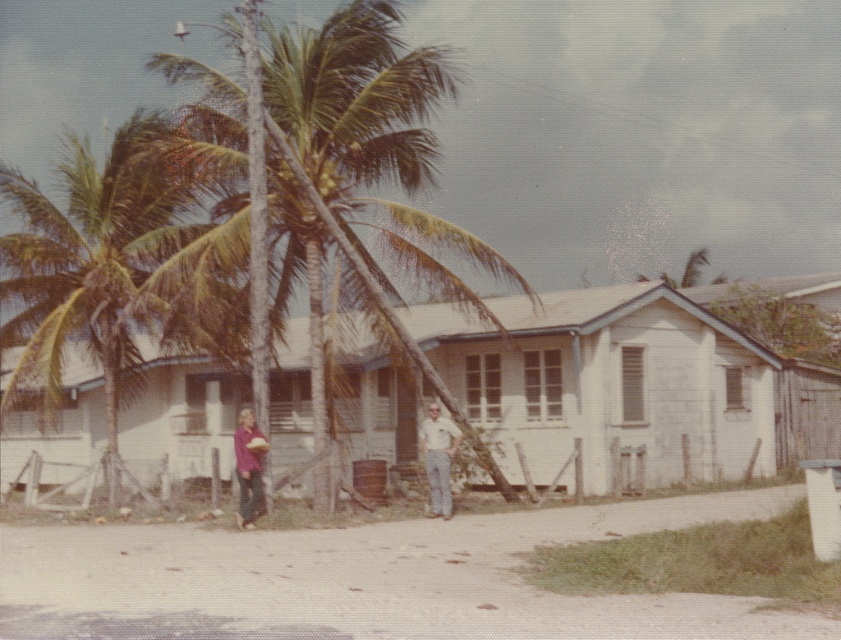
Question: Is green leafy coconut tree at center positioned before white cotton shirt at center?

Choices:
 (A) no
 (B) yes

Answer: (B)

Question: Based on their relative distances, which object is nearer to the white wood house at center?

Choices:
 (A) green leafy palm tree at center
 (B) green leafy coconut tree at center
 (C) matte purple shirt at center

Answer: (B)

Question: Which object is the farthest from the green leafy coconut tree at center?

Choices:
 (A) matte purple shirt at center
 (B) white cotton shirt at center
 (C) green leafy palm tree at center

Answer: (A)

Question: Which point is farther to the camera?

Choices:
 (A) green leafy palm tree at center
 (B) white wood house at center

Answer: (B)

Question: Is white cotton shirt at center to the left of matte purple shirt at center from the viewer's perspective?

Choices:
 (A) no
 (B) yes

Answer: (A)

Question: Is green leafy palm tree at center further to camera compared to matte purple shirt at center?

Choices:
 (A) no
 (B) yes

Answer: (B)